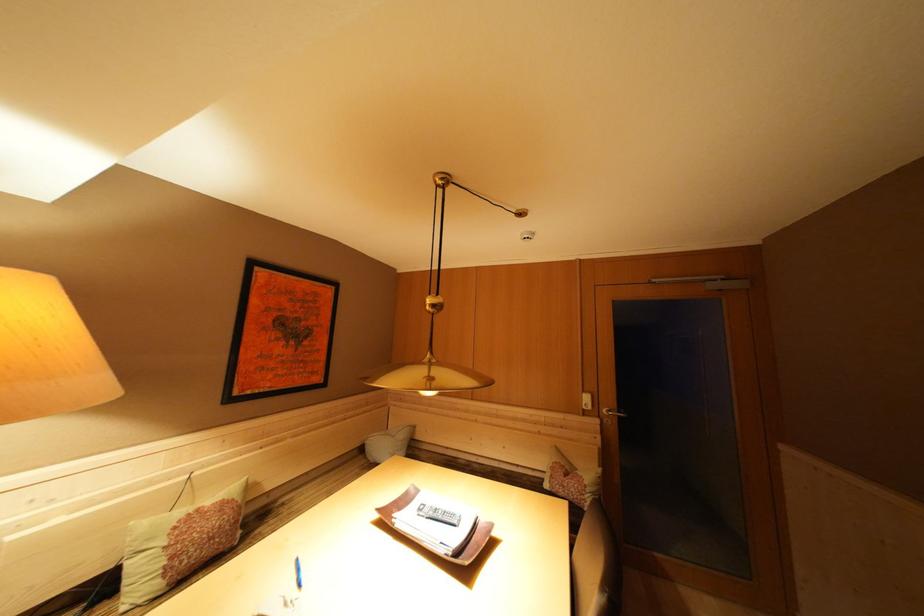
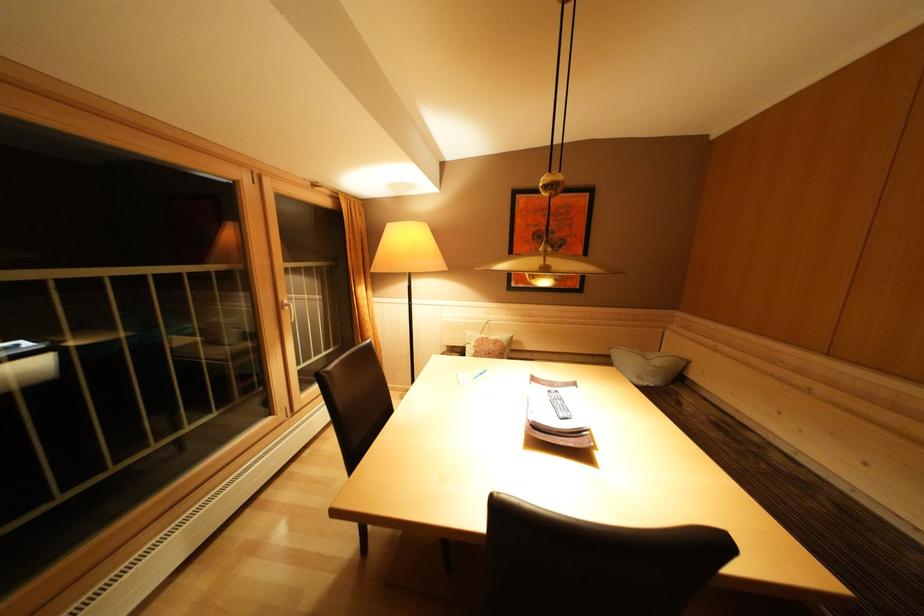
Question: How did the camera likely rotate?

Choices:
 (A) Left
 (B) Right
 (C) Up
 (D) Down

Answer: (A)